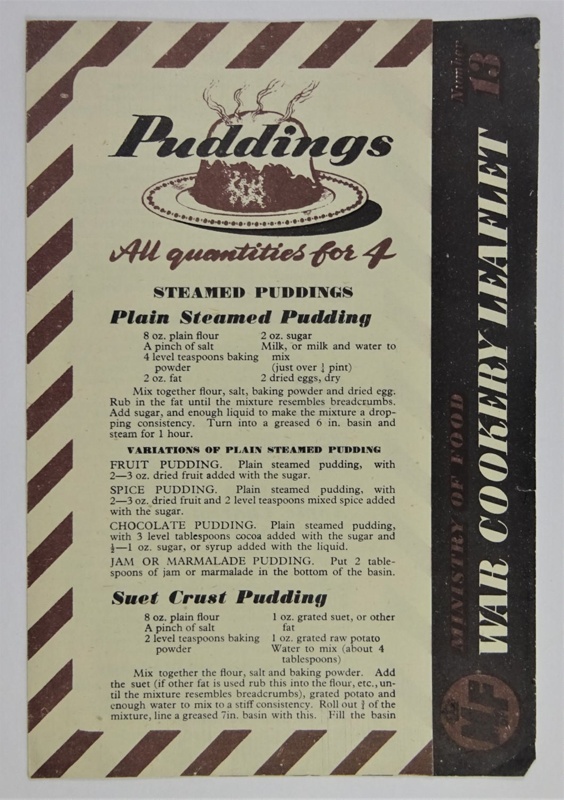
Where is `plate`? This screenshot has height=800, width=564. plate is located at coordinates (352, 198).